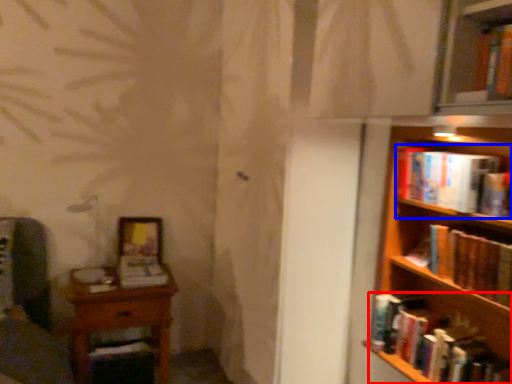
Question: Which object is closer to the camera taking this photo, book (highlighted by a red box) or book (highlighted by a blue box)?

Choices:
 (A) book
 (B) book

Answer: (A)